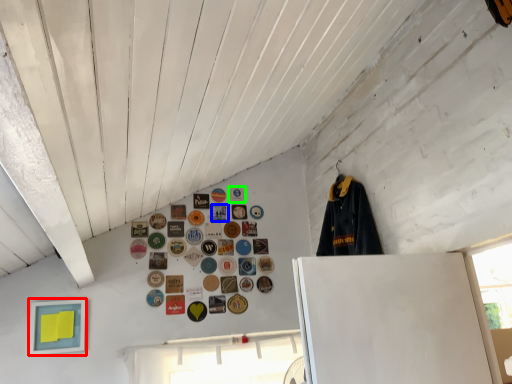
Question: Estimate the real-world distances between objects in this image. Which object is closer to picture frame (highlighted by a red box), button (highlighted by a blue box) or button (highlighted by a green box)?

Choices:
 (A) button
 (B) button

Answer: (A)